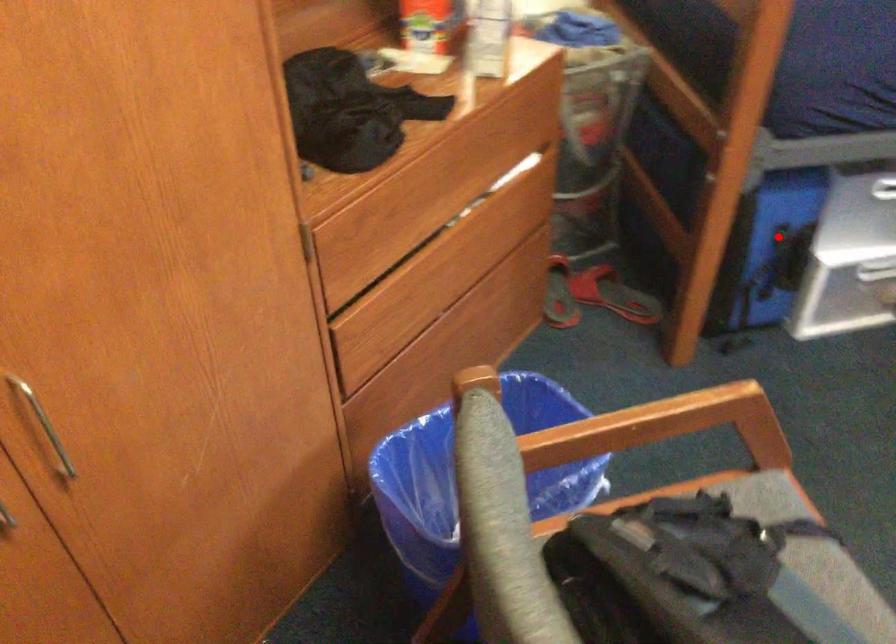
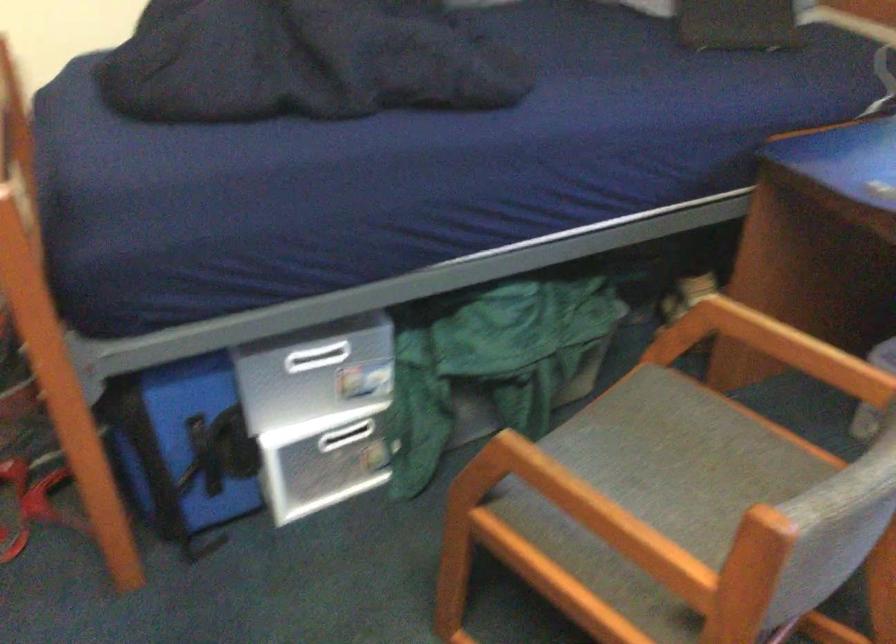
Question: I am providing you with two images of the same scene from different viewpoints. Given a red point in image1, look at the same physical point in image2. Is it:

Choices:
 (A) Closer to the viewpoint
 (B) Farther from the viewpoint

Answer: (A)